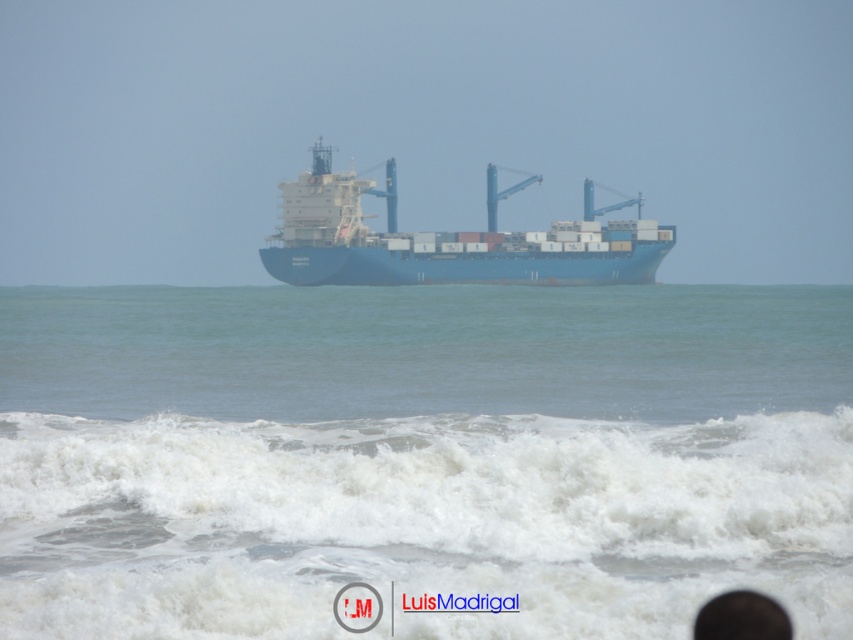
Consider the image. Between blue water at center and white frothy wave at lower center, which one is positioned higher?

Positioned higher is blue water at center.

Is blue water at center positioned behind white frothy wave at lower center?

No.

Who is more distant from viewer, (122, 324) or (202, 417)?

The point (122, 324) is behind.

At what (x,y) coordinates should I click in order to perform the action: click on blue water at center. Please return your answer as a coordinate pair (x, y). This screenshot has height=640, width=853. Looking at the image, I should click on (421, 456).

Can you confirm if white frothy wave at lower center is positioned to the right of blue matte container ship at center?

In fact, white frothy wave at lower center is to the left of blue matte container ship at center.

Does point (474, 548) come behind point (354, 275)?

No, it is not.

Identify the location of white frothy wave at lower center. The height and width of the screenshot is (640, 853). (427, 492).

Does blue water at center have a lesser height compared to blue matte container ship at center?

Indeed, blue water at center has a lesser height compared to blue matte container ship at center.

Does blue water at center appear under blue matte container ship at center?

Yes.

In order to click on blue water at center in this screenshot , I will do (421, 456).

This screenshot has height=640, width=853. What are the coordinates of `blue water at center` in the screenshot? It's located at (421, 456).